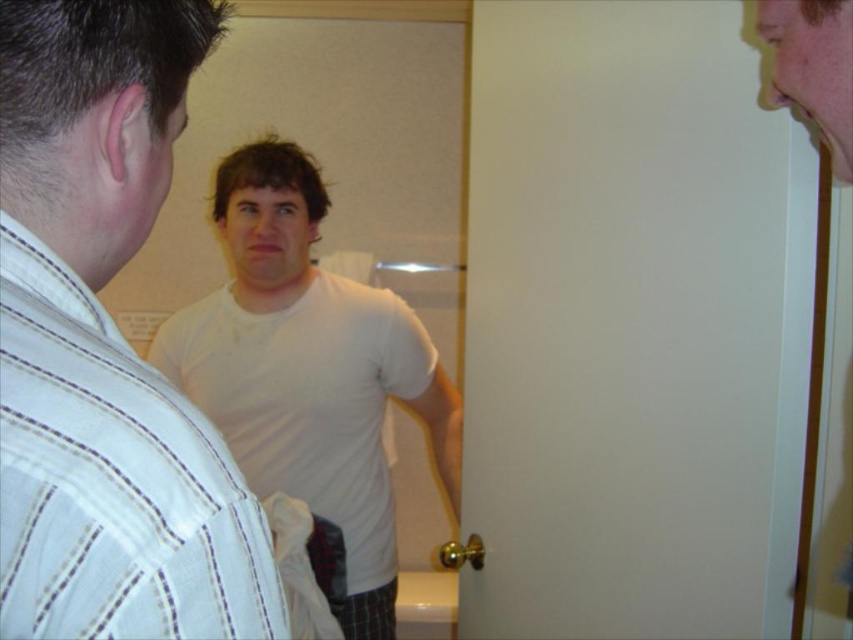
Can you confirm if white cotton t-shirt at center is shorter than smooth skin face at upper right?

No.

Is point (91, 458) less distant than point (846, 112)?

Yes.

What are the coordinates of `white cotton t-shirt at center` in the screenshot? It's located at (105, 346).

Can you confirm if white cotton t-shirt at center is taller than white matte t-shirt at center?

Incorrect, white cotton t-shirt at center's height is not larger of white matte t-shirt at center's.

Which is more to the left, white cotton t-shirt at center or white matte t-shirt at center?

white matte t-shirt at center

Is point (50, 56) in front of point (334, 500)?

Yes, point (50, 56) is in front of point (334, 500).

You are a GUI agent. You are given a task and a screenshot of the screen. Output one action in this format:
    pyautogui.click(x=<x>, y=<y>)
    Task: Click on the white cotton t-shirt at center
    
    Given the screenshot: What is the action you would take?
    pyautogui.click(x=105, y=346)

Can you confirm if white matte t-shirt at center is smaller than smooth skin face at upper right?

No.

Identify the location of white matte t-shirt at center. The height and width of the screenshot is (640, 853). (309, 371).

What are the coordinates of `white matte t-shirt at center` in the screenshot? It's located at (309, 371).